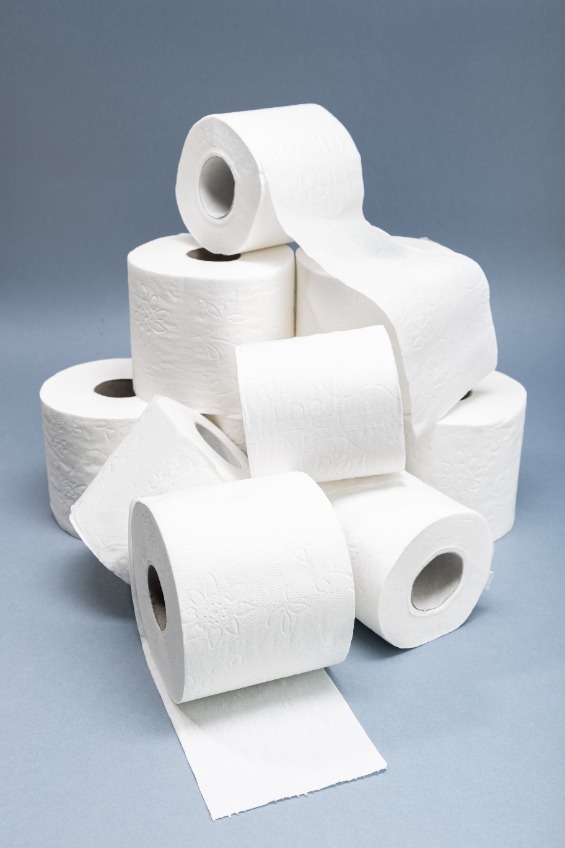
The width and height of the screenshot is (565, 848). Identify the location of toilet paper rolls. (249, 616), (376, 562), (329, 445), (464, 455), (188, 450), (103, 403), (190, 331), (241, 205), (319, 293).